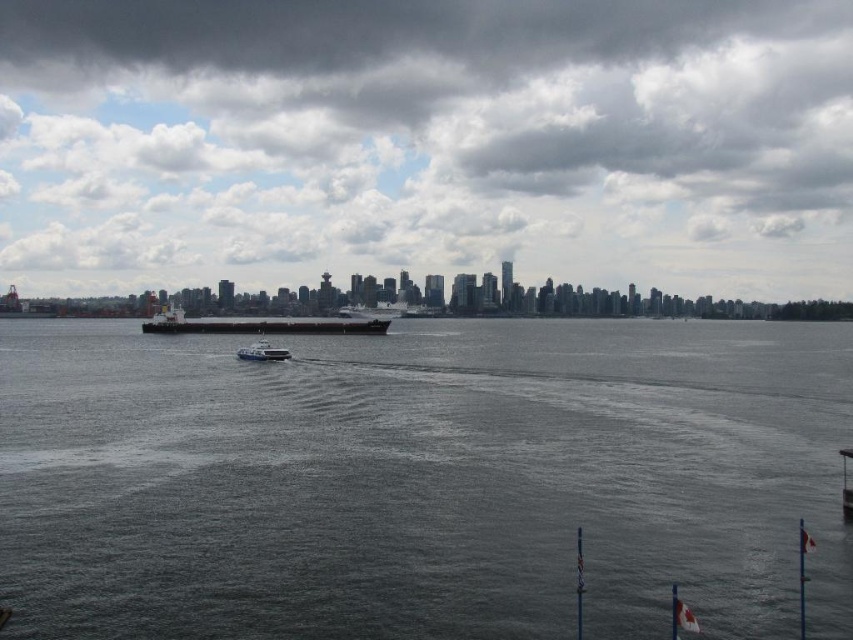
You are a photographer planning to capture the matte black ship at center and the white plastic boat at center in the same frame. Given their sizes, which vessel will appear wider in the photograph?

The matte black ship at center will appear wider in the photograph because its width surpasses that of the white plastic boat at center.

You are standing at the point closest to the viewer in the image. Which of the two points, point [793,77] or point [248,326], is farther away from you?

Point [793,77] is farther away because it is positioned behind point [248,326], which is closer to the viewer.